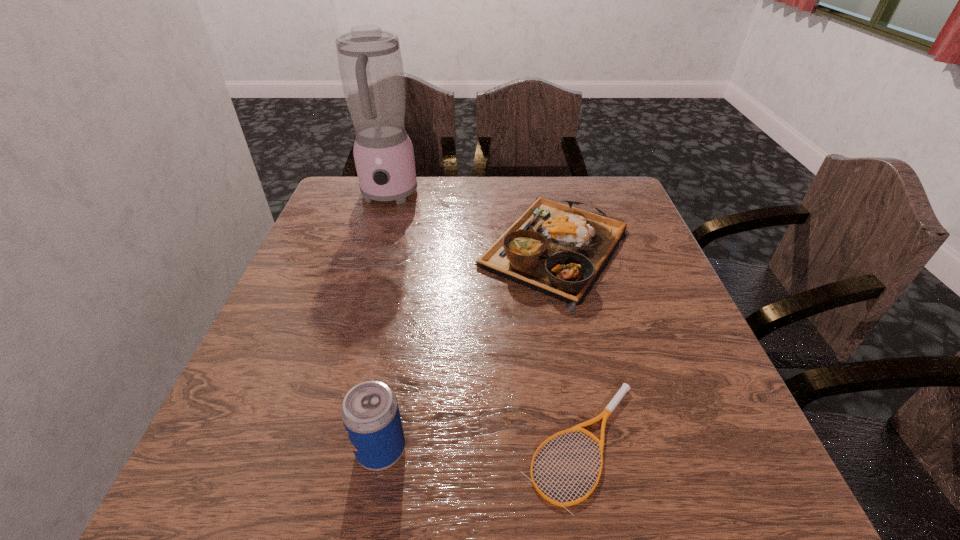
Locate an element on the screen. unoccupied area between the shortest object and the third shortest object is located at coordinates pyautogui.click(x=482, y=447).

Locate an element on the screen. This screenshot has width=960, height=540. object that is the second closest to the shortest object is located at coordinates (559, 250).

What are the coordinates of `the second closest object to the shortest object` in the screenshot? It's located at (559, 250).

I want to click on vacant area in the image that satisfies the following two spatial constraints: 1. on the base of the second shortest object near the control knob; 2. on the left side of the food processor, so click(372, 247).

Locate an element on the screen. This screenshot has height=540, width=960. free point that satisfies the following two spatial constraints: 1. on the base of the food processor near the control knob; 2. on the right side of the tennis racket is located at coordinates (313, 444).

Image resolution: width=960 pixels, height=540 pixels. Find the location of `vacant space that satisfies the following two spatial constraints: 1. on the base of the shortest object near the control knob; 2. on the left side of the tallest object`. vacant space that satisfies the following two spatial constraints: 1. on the base of the shortest object near the control knob; 2. on the left side of the tallest object is located at coordinates (313, 444).

The image size is (960, 540). I want to click on vacant area in the image that satisfies the following two spatial constraints: 1. on the base of the food processor near the control knob; 2. on the left side of the shortest object, so click(x=313, y=444).